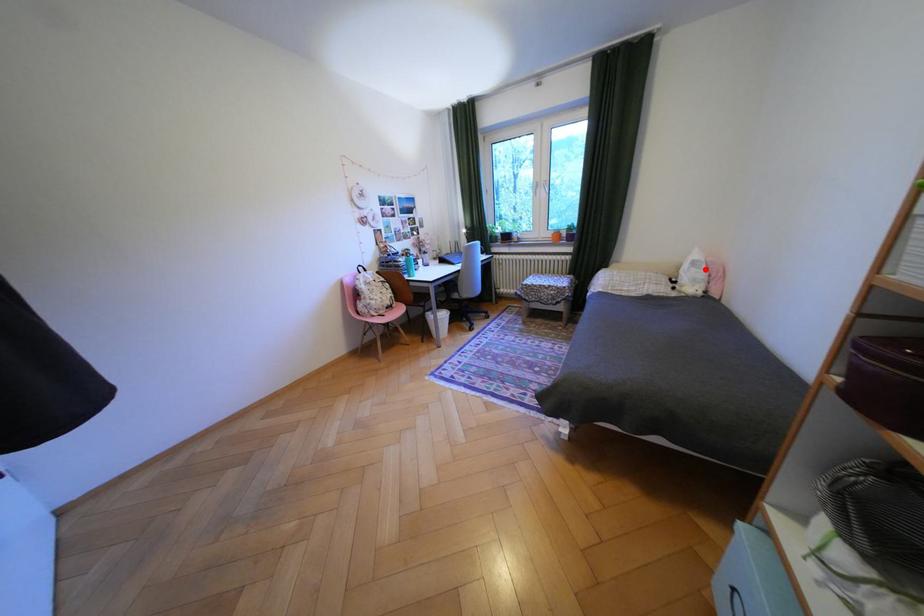
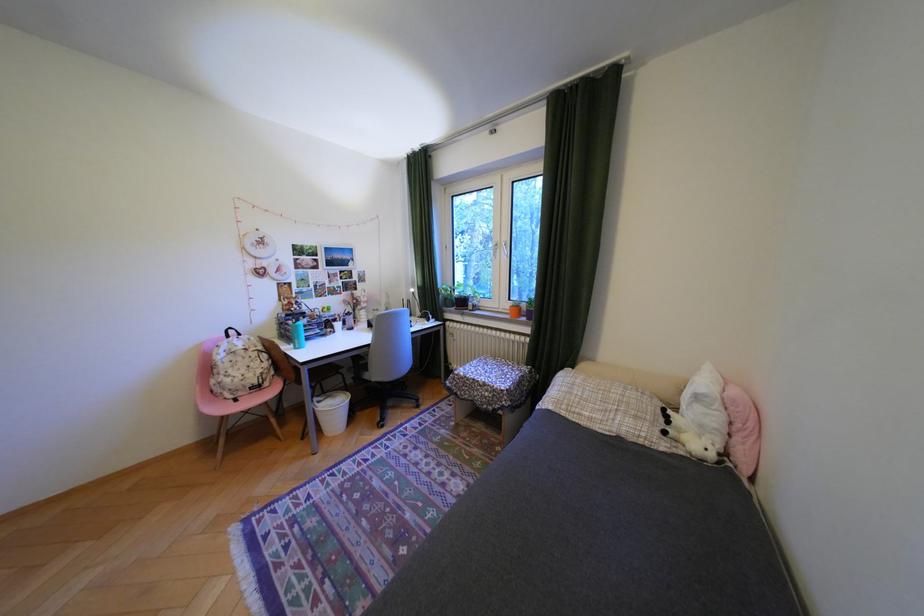
Question: I am providing you with two images of the same scene from different viewpoints. Given a red point in image1, look at the same physical point in image2. Is it:

Choices:
 (A) Closer to the viewpoint
 (B) Farther from the viewpoint

Answer: (B)